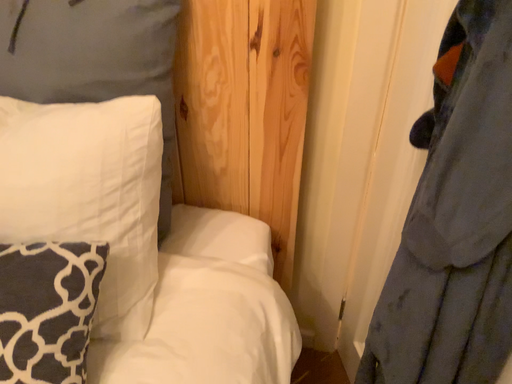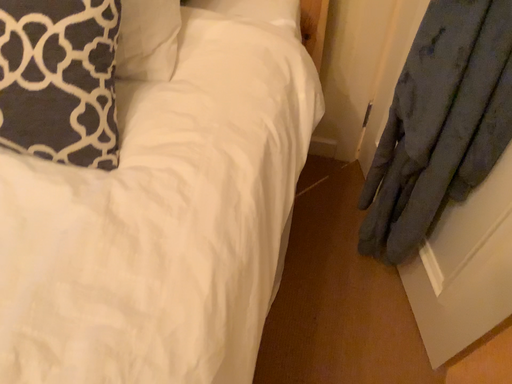
Question: Which way did the camera rotate in the video?

Choices:
 (A) rotated upward
 (B) rotated downward

Answer: (B)